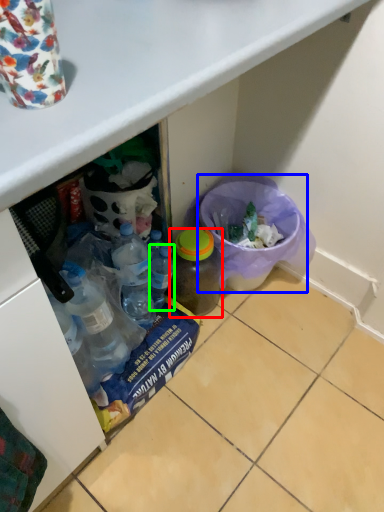
Question: Which object is the closest to the bottle (highlighted by a red box)? Choose among these: recycling bin (highlighted by a blue box) or bottle (highlighted by a green box).

Choices:
 (A) recycling bin
 (B) bottle

Answer: (B)